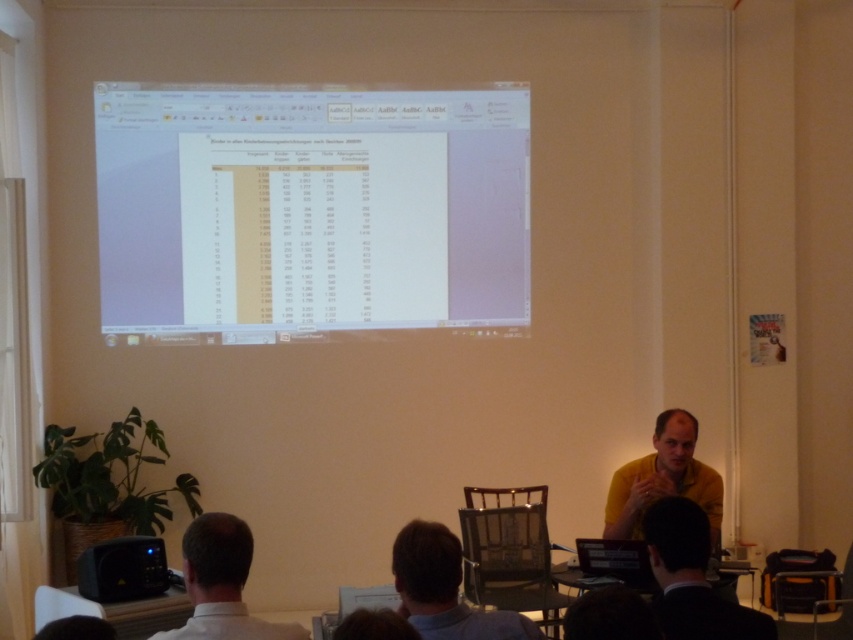
Question: Which point is farther from the camera taking this photo?

Choices:
 (A) (x=370, y=305)
 (B) (x=677, y=499)
 (C) (x=410, y=582)
 (D) (x=718, y=520)

Answer: (A)

Question: Observing the image, what is the correct spatial positioning of white paper at center in reference to black plastic projector at lower left?

Choices:
 (A) below
 (B) above

Answer: (B)

Question: Which of the following is the closest to the observer?

Choices:
 (A) (325, 108)
 (B) (242, 529)

Answer: (B)

Question: Can you confirm if white paper at center is thinner than dark brown hair at center?

Choices:
 (A) no
 (B) yes

Answer: (A)

Question: Does light brown hair at lower left have a larger size compared to black plastic projector at lower left?

Choices:
 (A) no
 (B) yes

Answer: (B)

Question: Among these objects, which one is nearest to the camera?

Choices:
 (A) dark brown hair at center
 (B) black plastic projector at lower left
 (C) dark suit at lower right
 (D) yellow matte shirt at center

Answer: (A)